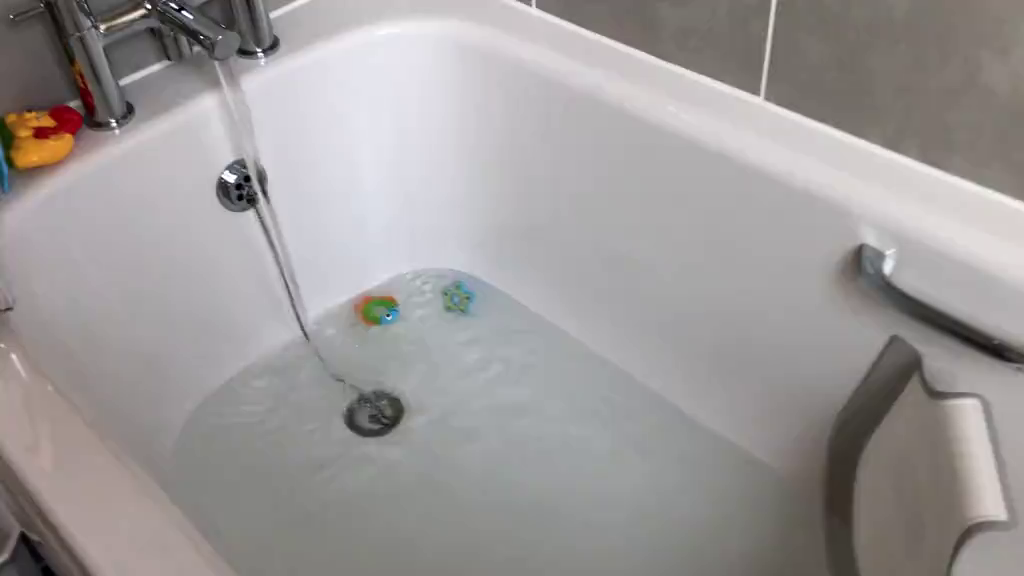
Locate an element on the screen. The height and width of the screenshot is (576, 1024). left silver handle is located at coordinates (870, 264).